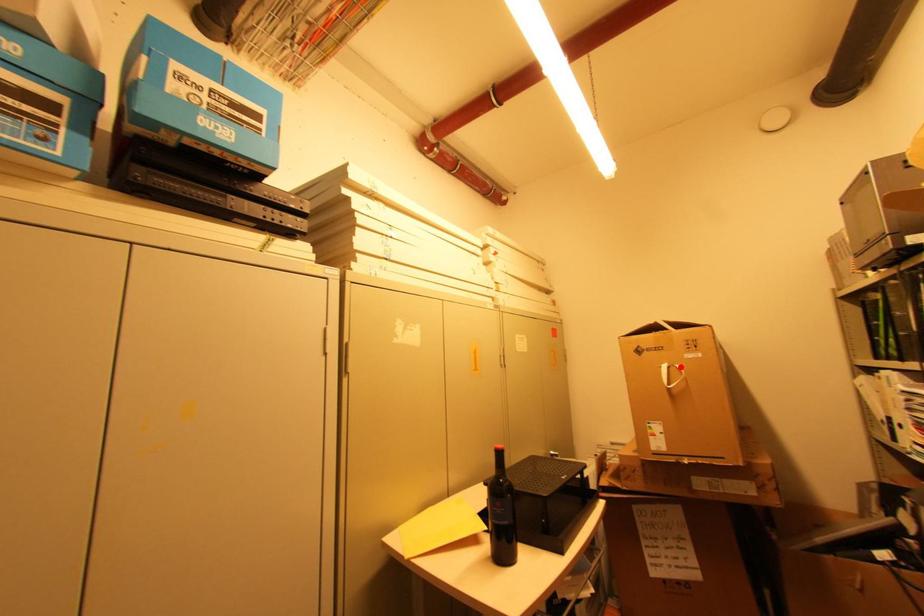
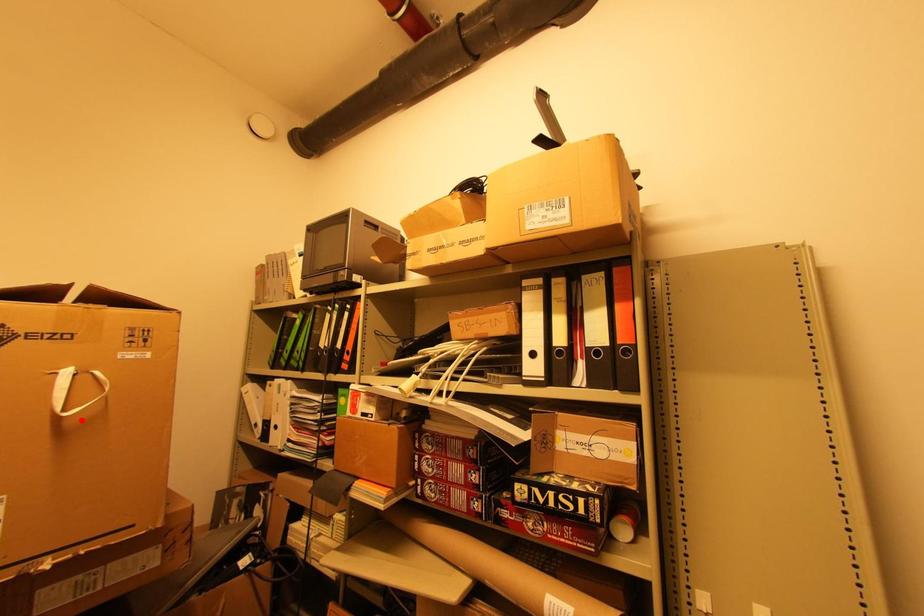
I am providing you with two images of the same scene from different viewpoints. A red point is marked on the first image and another point is marked on the second image. Do the highlighted points in image1 and image2 indicate the same real-world spot?

No